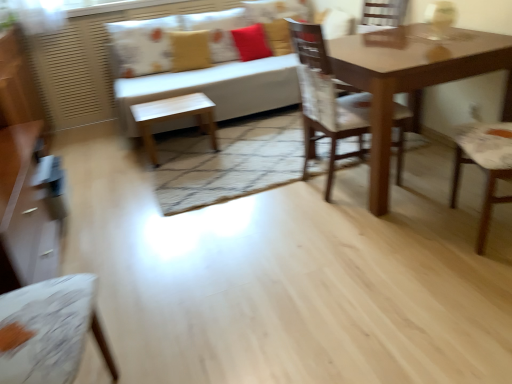
Question: Is there a large distance between wooden chair at center and light wood/finely finished table at center?

Choices:
 (A) no
 (B) yes

Answer: (B)

Question: Can you confirm if wooden chair at center is taller than light wood/finely finished table at center?

Choices:
 (A) yes
 (B) no

Answer: (A)

Question: Does wooden chair at center contain light wood/finely finished table at center?

Choices:
 (A) yes
 (B) no

Answer: (B)

Question: Is wooden chair at center outside light wood/finely finished table at center?

Choices:
 (A) no
 (B) yes

Answer: (B)

Question: From a real-world perspective, is wooden chair at center beneath light wood/finely finished table at center?

Choices:
 (A) no
 (B) yes

Answer: (A)

Question: Is wooden chair at center at the right side of light wood/finely finished table at center?

Choices:
 (A) no
 (B) yes

Answer: (B)

Question: From a real-world perspective, is matte brown dresser at left on top of printed fabric pillow at upper center, arranged as the 1th pillow when viewed from the left?

Choices:
 (A) no
 (B) yes

Answer: (A)

Question: Is matte brown dresser at left smaller than printed fabric pillow at upper center, arranged as the 1th pillow when viewed from the left?

Choices:
 (A) no
 (B) yes

Answer: (A)

Question: Is the depth of matte brown dresser at left less than that of printed fabric pillow at upper center, arranged as the 1th pillow when viewed from the left?

Choices:
 (A) yes
 (B) no

Answer: (A)

Question: Is matte brown dresser at left positioned far away from printed fabric pillow at upper center, arranged as the 1th pillow when viewed from the left?

Choices:
 (A) no
 (B) yes

Answer: (B)

Question: Is matte brown dresser at left shorter than printed fabric pillow at upper center, which is counted as the third pillow, starting from the right?

Choices:
 (A) yes
 (B) no

Answer: (B)

Question: Is matte brown dresser at left turned away from printed fabric pillow at upper center, arranged as the 1th pillow when viewed from the left?

Choices:
 (A) no
 (B) yes

Answer: (A)

Question: Is white fabric couch at upper center behind matte yellow pillow at upper center, which is the 2th pillow from right to left?

Choices:
 (A) no
 (B) yes

Answer: (A)